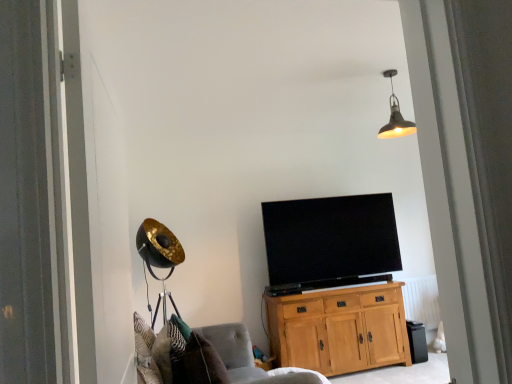
Question: Is black plastic trash bin at lower right in front of or behind metallic pendant light at upper center in the image?

Choices:
 (A) behind
 (B) front

Answer: (A)

Question: Considering the positions of black plastic trash bin at lower right and metallic pendant light at upper center in the image, is black plastic trash bin at lower right wider or thinner than metallic pendant light at upper center?

Choices:
 (A) wide
 (B) thin

Answer: (B)

Question: Which is farther from the black plastic trash bin at lower right?

Choices:
 (A) soft gray fabric chair at lower left
 (B) black glossy tv at center
 (C) patterned fabric pillow at lower left
 (D) light oak cabinet at center
 (E) white painted radiator at lower right

Answer: (C)

Question: Estimate the real-world distances between objects in this image. Which object is closer to the patterned fabric pillow at lower left?

Choices:
 (A) black glossy tv at center
 (B) metallic pendant light at upper center
 (C) white painted radiator at lower right
 (D) soft gray fabric chair at lower left
 (E) black plastic trash bin at lower right

Answer: (D)